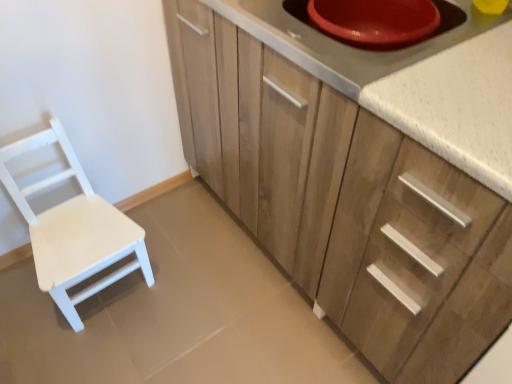
Question: Does white speckled countertop at upper right have a lesser height compared to white matte wood chair at left?

Choices:
 (A) yes
 (B) no

Answer: (A)

Question: Would you say white speckled countertop at upper right is a long distance from white matte wood chair at left?

Choices:
 (A) no
 (B) yes

Answer: (A)

Question: Considering the relative sizes of white speckled countertop at upper right and white matte wood chair at left in the image provided, is white speckled countertop at upper right bigger than white matte wood chair at left?

Choices:
 (A) yes
 (B) no

Answer: (A)

Question: Is white speckled countertop at upper right looking in the opposite direction of white matte wood chair at left?

Choices:
 (A) yes
 (B) no

Answer: (B)

Question: From the image's perspective, is white speckled countertop at upper right located beneath white matte wood chair at left?

Choices:
 (A) yes
 (B) no

Answer: (B)

Question: Based on their positions, is wooden cabinet at center located to the left or right of red plastic bowl at upper right?

Choices:
 (A) left
 (B) right

Answer: (B)

Question: In terms of width, does wooden cabinet at center look wider or thinner when compared to red plastic bowl at upper right?

Choices:
 (A) wide
 (B) thin

Answer: (A)

Question: Considering their positions, is wooden cabinet at center located in front of or behind red plastic bowl at upper right?

Choices:
 (A) behind
 (B) front

Answer: (B)

Question: Is wooden cabinet at center taller or shorter than red plastic bowl at upper right?

Choices:
 (A) short
 (B) tall

Answer: (B)

Question: Looking at their shapes, would you say red plastic bowl at upper right is wider or thinner than wooden cabinet at center?

Choices:
 (A) thin
 (B) wide

Answer: (A)

Question: From a real-world perspective, is red plastic bowl at upper right physically located above or below wooden cabinet at center?

Choices:
 (A) above
 (B) below

Answer: (A)

Question: Looking at the image, does red plastic bowl at upper right seem bigger or smaller compared to wooden cabinet at center?

Choices:
 (A) small
 (B) big

Answer: (A)

Question: Considering the positions of point pyautogui.click(x=367, y=77) and point pyautogui.click(x=464, y=362), is point pyautogui.click(x=367, y=77) closer or farther from the camera than point pyautogui.click(x=464, y=362)?

Choices:
 (A) farther
 (B) closer

Answer: (B)

Question: Choose the correct answer: Is white matte wood chair at left inside wooden cabinet at center or outside it?

Choices:
 (A) inside
 (B) outside

Answer: (B)

Question: Does point (88, 183) appear closer or farther from the camera than point (202, 51)?

Choices:
 (A) closer
 (B) farther

Answer: (B)